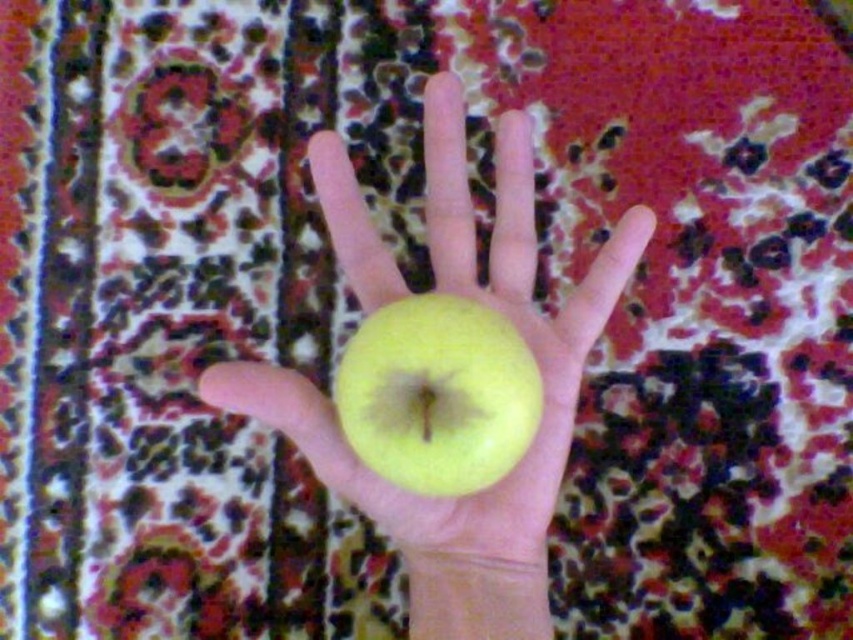
Does yellow matte apple at center appear over green matte apple at center?

Yes, yellow matte apple at center is above green matte apple at center.

Between yellow matte apple at center and green matte apple at center, which one is positioned higher?

yellow matte apple at center is higher up.

Locate an element on the screen. The height and width of the screenshot is (640, 853). yellow matte apple at center is located at coordinates (486, 304).

Find the location of a particular element. yellow matte apple at center is located at coordinates (486, 304).